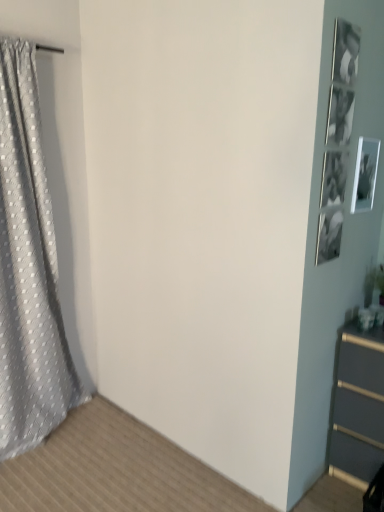
Question: Should I look upward or downward to see gray textured curtain at left?

Choices:
 (A) up
 (B) down

Answer: (B)

Question: Considering the relative positions of white glossy picture frame at upper right and gray textured curtain at left in the image provided, is white glossy picture frame at upper right to the right of gray textured curtain at left from the viewer's perspective?

Choices:
 (A) yes
 (B) no

Answer: (A)

Question: Is gray textured curtain at left surrounded by white glossy picture frame at upper right?

Choices:
 (A) no
 (B) yes

Answer: (A)

Question: From a real-world perspective, is white glossy picture frame at upper right positioned under gray textured curtain at left based on gravity?

Choices:
 (A) yes
 (B) no

Answer: (B)

Question: Is white glossy picture frame at upper right located outside gray textured curtain at left?

Choices:
 (A) yes
 (B) no

Answer: (A)

Question: Can you confirm if white glossy picture frame at upper right is thinner than gray textured curtain at left?

Choices:
 (A) no
 (B) yes

Answer: (B)

Question: Considering the relative sizes of white glossy picture frame at upper right and gray textured curtain at left in the image provided, is white glossy picture frame at upper right smaller than gray textured curtain at left?

Choices:
 (A) no
 (B) yes

Answer: (B)

Question: Considering the relative positions of gray textured curtain at left and white glossy picture frame at upper right in the image provided, is gray textured curtain at left to the right of white glossy picture frame at upper right from the viewer's perspective?

Choices:
 (A) yes
 (B) no

Answer: (B)

Question: Is gray textured curtain at left oriented towards white glossy picture frame at upper right?

Choices:
 (A) yes
 (B) no

Answer: (B)

Question: Does gray textured curtain at left have a greater width compared to white glossy picture frame at upper right?

Choices:
 (A) no
 (B) yes

Answer: (B)

Question: Can you confirm if gray textured curtain at left is shorter than white glossy picture frame at upper right?

Choices:
 (A) no
 (B) yes

Answer: (A)

Question: Does gray textured curtain at left have a greater height compared to white glossy picture frame at upper right?

Choices:
 (A) no
 (B) yes

Answer: (B)

Question: Is gray textured curtain at left looking in the opposite direction of white glossy picture frame at upper right?

Choices:
 (A) yes
 (B) no

Answer: (B)

Question: In the image, is white glossy picture frame at upper right positioned in front of or behind gray textured curtain at left?

Choices:
 (A) behind
 (B) front

Answer: (A)